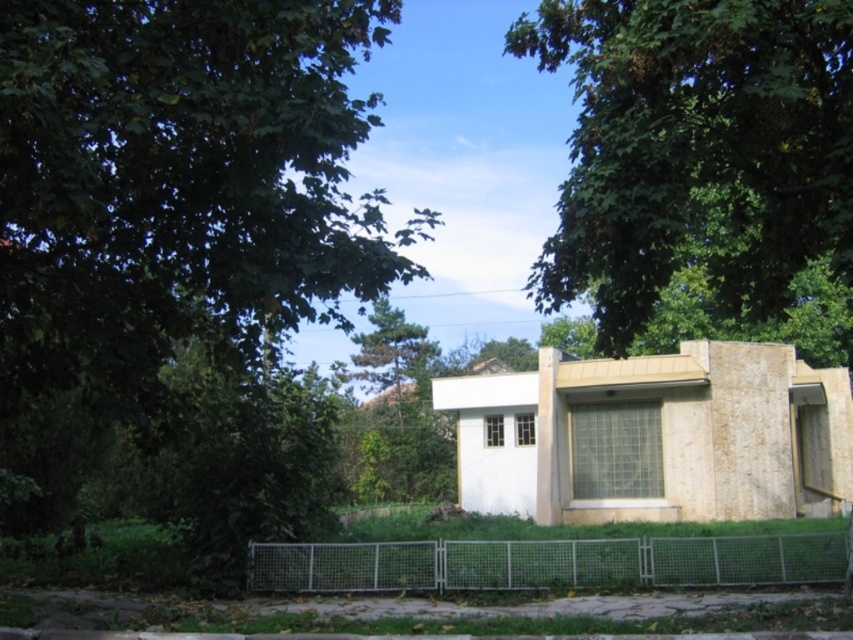
Is the position of green leafy tree at upper center more distant than that of metallic wire mesh fence at lower center?

No, green leafy tree at upper center is in front of metallic wire mesh fence at lower center.

At what (x,y) coordinates should I click in order to perform the action: click on green leafy tree at upper center. Please return your answer as a coordinate pair (x, y). Looking at the image, I should click on (695, 150).

What do you see at coordinates (695, 150) in the screenshot? I see `green leafy tree at upper center` at bounding box center [695, 150].

This screenshot has height=640, width=853. Identify the location of green leafy tree at upper center. click(x=695, y=150).